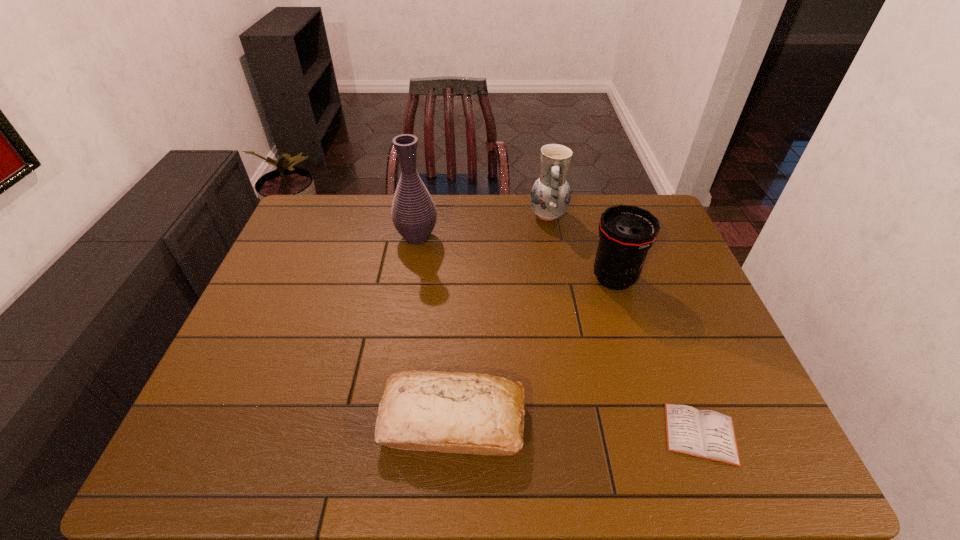
Identify the location of object located in the near right corner section of the desktop. The width and height of the screenshot is (960, 540). (706, 434).

In the image, there is a desktop. Where is `free space at the far edge`? The height and width of the screenshot is (540, 960). free space at the far edge is located at coordinates (572, 231).

This screenshot has width=960, height=540. I want to click on vacant space at the near edge, so click(390, 465).

You are a GUI agent. You are given a task and a screenshot of the screen. Output one action in this format:
    pyautogui.click(x=<x>, y=<y>)
    Task: Click on the vacant space at the left edge
    Image resolution: width=960 pixels, height=540 pixels.
    Given the screenshot: What is the action you would take?
    pyautogui.click(x=243, y=421)

The image size is (960, 540). Identify the location of free space at the right edge of the desktop. (662, 276).

Image resolution: width=960 pixels, height=540 pixels. Identify the location of vacant area at the near right corner of the desktop. (758, 440).

Identify the location of free space that is in between the shortest object and the bread. pos(577,427).

I want to click on vacant point located between the telephoto lens and the tallest object, so click(516, 258).

Where is `free space between the shortest object and the second shortest object`? free space between the shortest object and the second shortest object is located at coordinates (577, 427).

This screenshot has height=540, width=960. I want to click on vacant area that lies between the third nearest object and the vase, so click(x=516, y=258).